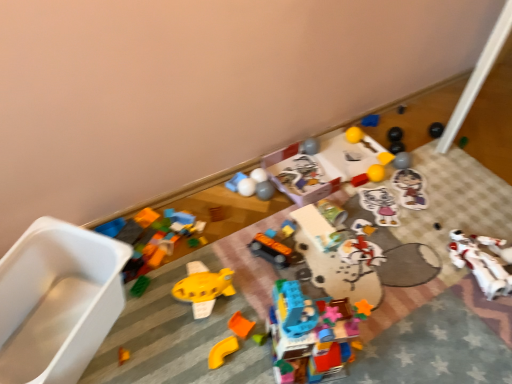
This screenshot has width=512, height=384. Identify the location of free location to the right of white matte ball at center, arranged as the 6th toy when viewed from the left. (292, 195).